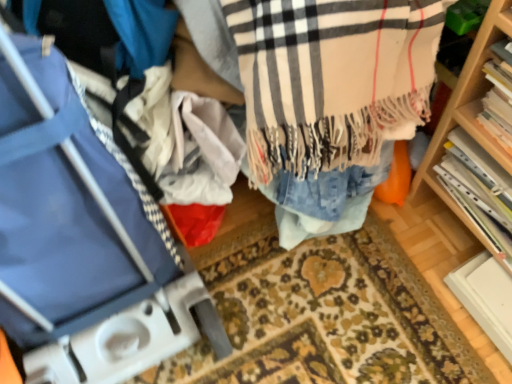
Question: From a real-world perspective, is beige plaid scarf at center on hardcover book at right, placed as the first book when sorted from front to back?

Choices:
 (A) yes
 (B) no

Answer: (B)

Question: Considering the relative positions of beige plaid scarf at center and hardcover book at right, placed as the first book when sorted from front to back, in the image provided, is beige plaid scarf at center to the left of hardcover book at right, placed as the first book when sorted from front to back, from the viewer's perspective?

Choices:
 (A) no
 (B) yes

Answer: (B)

Question: Is beige plaid scarf at center shorter than hardcover book at right, which is counted as the second book, starting from the back?

Choices:
 (A) no
 (B) yes

Answer: (A)

Question: Is the depth of beige plaid scarf at center less than that of hardcover book at right, which is counted as the second book, starting from the back?

Choices:
 (A) yes
 (B) no

Answer: (A)

Question: Does beige plaid scarf at center have a larger size compared to hardcover book at right, placed as the first book when sorted from front to back?

Choices:
 (A) yes
 (B) no

Answer: (A)

Question: Is beige plaid scarf at center turned away from hardcover book at right, placed as the first book when sorted from front to back?

Choices:
 (A) yes
 (B) no

Answer: (B)

Question: Does hardcover book at right, the 1th book when ordered from back to front, have a lesser width compared to beige plaid scarf at center?

Choices:
 (A) yes
 (B) no

Answer: (A)

Question: Does hardcover book at right, the 1th book when ordered from back to front, have a greater width compared to beige plaid scarf at center?

Choices:
 (A) yes
 (B) no

Answer: (B)

Question: Considering the relative sizes of hardcover book at right, arranged as the 2th book when viewed from the front, and beige plaid scarf at center in the image provided, is hardcover book at right, arranged as the 2th book when viewed from the front, bigger than beige plaid scarf at center?

Choices:
 (A) no
 (B) yes

Answer: (A)

Question: Is hardcover book at right, arranged as the 2th book when viewed from the front, oriented away from beige plaid scarf at center?

Choices:
 (A) no
 (B) yes

Answer: (A)

Question: Are hardcover book at right, arranged as the 2th book when viewed from the front, and beige plaid scarf at center located far from each other?

Choices:
 (A) no
 (B) yes

Answer: (A)

Question: Are hardcover book at right, arranged as the 2th book when viewed from the front, and beige plaid scarf at center beside each other?

Choices:
 (A) no
 (B) yes

Answer: (A)

Question: From a real-world perspective, is blue fabric luggage at left on top of hardcover book at right, arranged as the 2th book when viewed from the front?

Choices:
 (A) yes
 (B) no

Answer: (A)